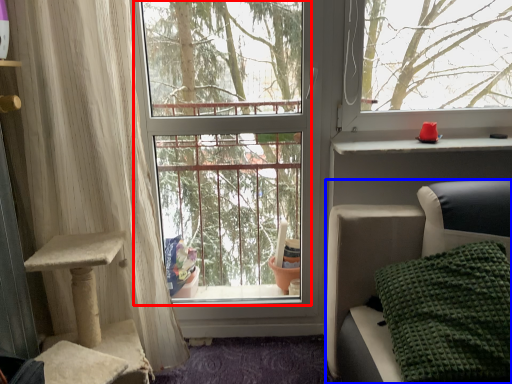
Question: Which object appears farthest to the camera in this image, window screen (highlighted by a red box) or furniture (highlighted by a blue box)?

Choices:
 (A) window screen
 (B) furniture

Answer: (A)